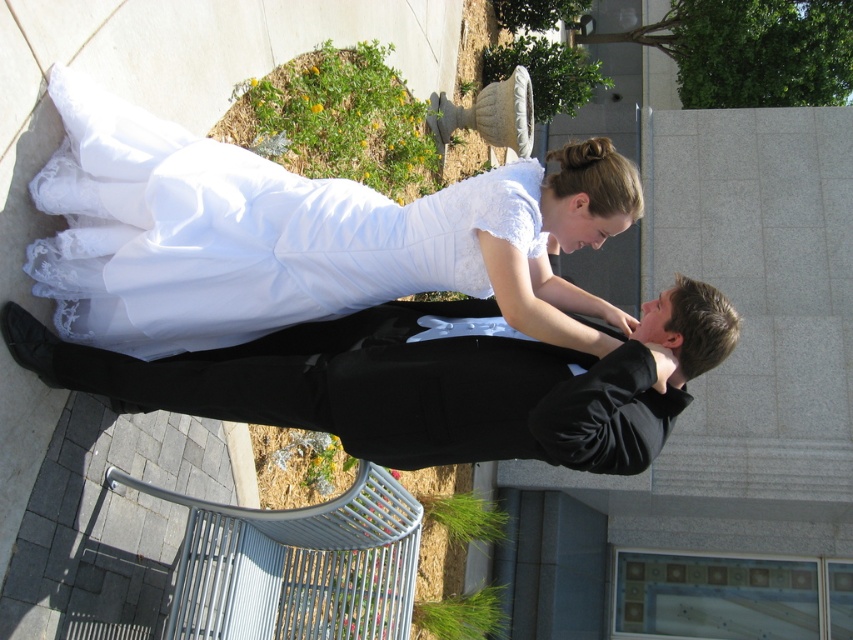
In the scene shown: Can you confirm if white satin dress at center is bigger than black satin suit at center?

No.

Does white satin dress at center have a smaller size compared to black satin suit at center?

Yes.

Find the location of a particular element. white satin dress at center is located at coordinates (299, 236).

I want to click on white satin dress at center, so click(x=299, y=236).